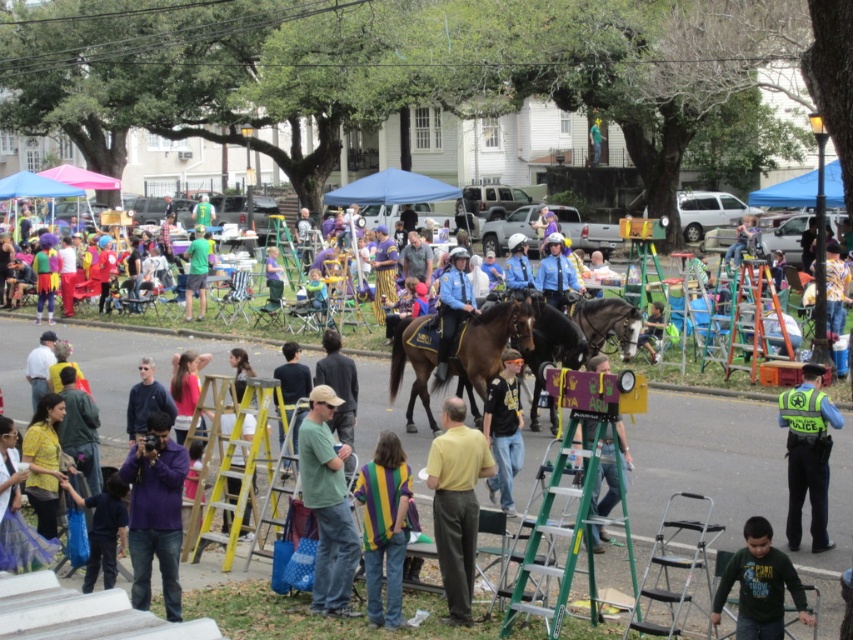
Question: Is mardi gras shirt at center behind yellow striped shirt at center?

Choices:
 (A) yes
 (B) no

Answer: (B)

Question: Which point is closer to the camera taking this photo?

Choices:
 (A) (509, 509)
 (B) (607, 488)

Answer: (A)

Question: Among these objects, which one is nearest to the camera?

Choices:
 (A) purple cotton shirt at lower left
 (B) mardi gras shirt at center
 (C) sweatshirt at center

Answer: (B)

Question: Can you confirm if brown glossy horse at center is positioned to the left of black leather jacket at center?

Choices:
 (A) yes
 (B) no

Answer: (A)

Question: Does green fleece shirt at lower right appear on the left side of green fabric shirt at center?

Choices:
 (A) no
 (B) yes

Answer: (A)

Question: Which point appears closest to the camera in this image?

Choices:
 (A) (627, 458)
 (B) (381, 509)

Answer: (B)